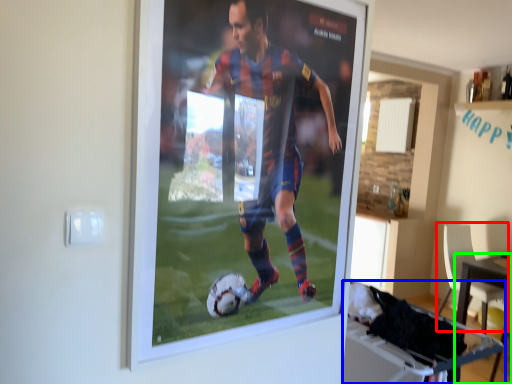
Question: Considering the real-world distances, which object is closest to chair (highlighted by a red box)? table (highlighted by a blue box) or table (highlighted by a green box).

Choices:
 (A) table
 (B) table

Answer: (B)